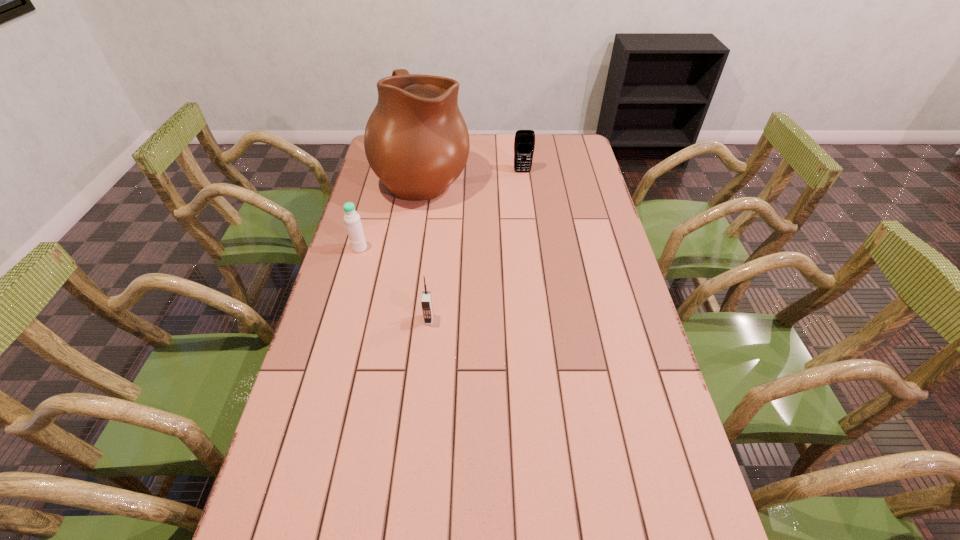
At what (x,y) coordinates should I click in order to perform the action: click on the tallest object. Please return your answer as a coordinate pair (x, y). This screenshot has width=960, height=540. Looking at the image, I should click on (416, 141).

The height and width of the screenshot is (540, 960). What are the coordinates of `the right cellular telephone` in the screenshot? It's located at (524, 143).

In order to click on the farther cellular telephone in this screenshot , I will do `click(524, 143)`.

Identify the location of water bottle. (353, 224).

Identify the location of the nearest object. The width and height of the screenshot is (960, 540). (426, 302).

You are a GUI agent. You are given a task and a screenshot of the screen. Output one action in this format:
    pyautogui.click(x=<x>, y=<y>)
    Task: Click on the nearer cellular telephone
    This screenshot has width=960, height=540.
    Given the screenshot: What is the action you would take?
    coord(426,302)

Find the location of a particular element. The image size is (960, 540). blank area located 0.100m at the spout of the cream pitcher is located at coordinates 496,177.

Locate an element on the screen. vacant space located 0.210m on the screen of the rightmost object is located at coordinates (526, 206).

This screenshot has height=540, width=960. Identify the location of vacant area situated on the back of the second nearest object. (x=369, y=215).

At what (x,y) coordinates should I click in order to perform the action: click on free space located on the front-facing side of the nearer cellular telephone. Please return your answer as a coordinate pair (x, y). Looking at the image, I should click on (424, 365).